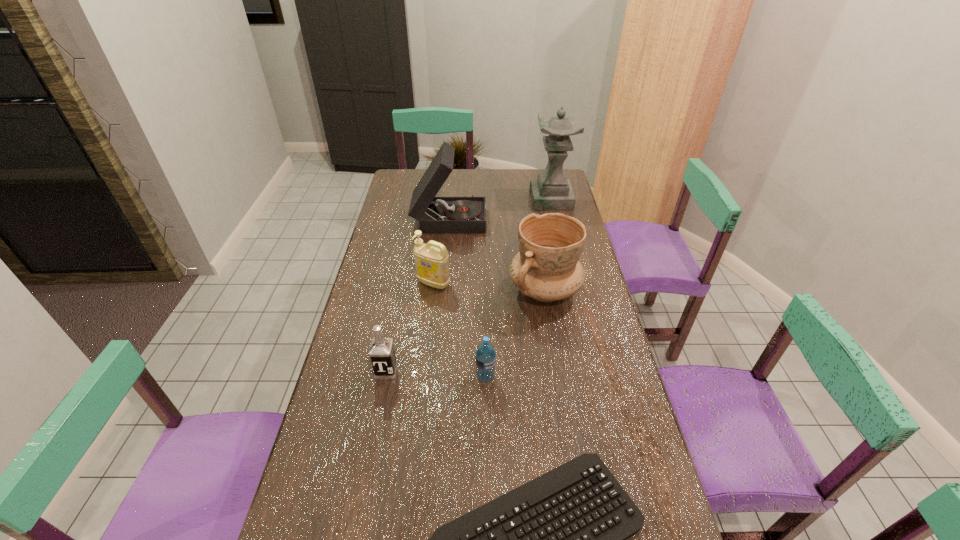
The width and height of the screenshot is (960, 540). In order to click on vacant space at the far edge of the desktop in this screenshot , I will do `click(470, 176)`.

The width and height of the screenshot is (960, 540). Identify the location of vacant region at the left edge of the desktop. (398, 344).

The width and height of the screenshot is (960, 540). In order to click on blank space at the right edge of the desktop in this screenshot , I will do `click(615, 349)`.

Where is `free space between the phonograph_record and the vodka`? The height and width of the screenshot is (540, 960). free space between the phonograph_record and the vodka is located at coordinates pos(418,294).

Find the location of `empty location between the water bottle and the pottery`. empty location between the water bottle and the pottery is located at coordinates (515, 333).

I want to click on free space between the vodka and the phonograph_record, so click(x=418, y=294).

Locate an element on the screen. The image size is (960, 540). vacant region between the detergent and the vodka is located at coordinates (410, 327).

This screenshot has width=960, height=540. What are the coordinates of `free spot between the water bottle and the vodka` in the screenshot? It's located at (436, 374).

This screenshot has width=960, height=540. What are the coordinates of `unoccupied position between the detergent and the fifth shortest object` in the screenshot? It's located at (489, 287).

Locate an element on the screen. Image resolution: width=960 pixels, height=540 pixels. empty location between the vodka and the pottery is located at coordinates (466, 330).